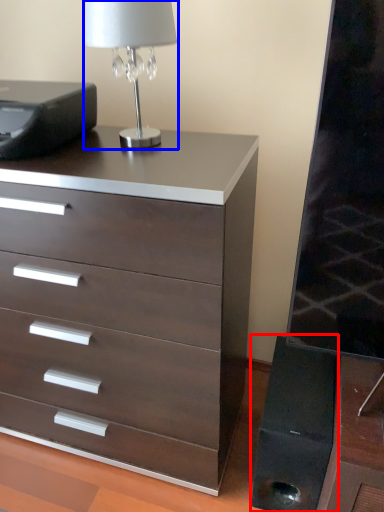
Question: Which object appears closest to the camera in this image, speaker (highlighted by a red box) or table lamp (highlighted by a blue box)?

Choices:
 (A) speaker
 (B) table lamp

Answer: (B)